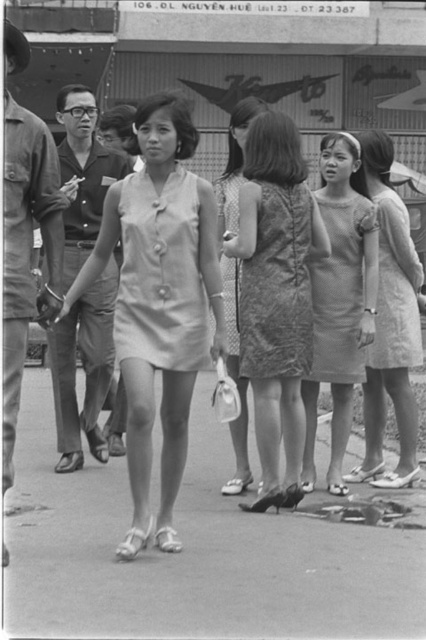
Between smooth concrete pavement at center and lace dress at center, which one has more height?

lace dress at center is taller.

In the scene shown: Who is more forward, (423,589) or (229,356)?

Point (423,589)

The width and height of the screenshot is (426, 640). What do you see at coordinates (192, 552) in the screenshot?
I see `smooth concrete pavement at center` at bounding box center [192, 552].

Where is `smooth concrete pavement at center`? The height and width of the screenshot is (640, 426). smooth concrete pavement at center is located at coordinates (192, 552).

Measure the distance between point (x=173, y=436) and camera.

Point (x=173, y=436) is 6.04 meters away from camera.

Who is positioned more to the right, light beige fabric dress at center or white textured dress at center?

Positioned to the right is white textured dress at center.

The image size is (426, 640). Identify the location of light beige fabric dress at center. (158, 301).

Is smooth concrete pavement at center wider than light beige fabric dress at center?

Yes, smooth concrete pavement at center is wider than light beige fabric dress at center.

Which is below, smooth concrete pavement at center or light beige fabric dress at center?

smooth concrete pavement at center is lower down.

I want to click on smooth concrete pavement at center, so click(192, 552).

What are the coordinates of `smooth concrete pavement at center` in the screenshot? It's located at (192, 552).